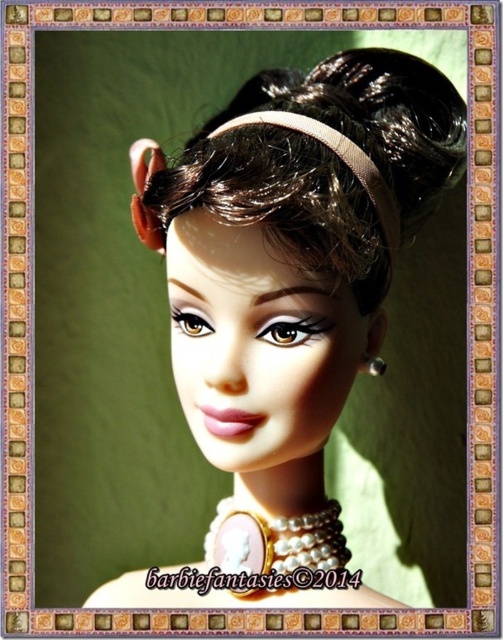
Can you confirm if brown matte headband at upper center is positioned to the left of silver metallic earring at upper center?

Correct, you'll find brown matte headband at upper center to the left of silver metallic earring at upper center.

Is brown matte headband at upper center shorter than silver metallic earring at upper center?

Incorrect, brown matte headband at upper center's height does not fall short of silver metallic earring at upper center's.

This screenshot has width=503, height=640. Describe the element at coordinates (327, 164) in the screenshot. I see `brown matte headband at upper center` at that location.

Where is `brown matte headband at upper center`? This screenshot has width=503, height=640. brown matte headband at upper center is located at coordinates (327, 164).

Who is taller, matte plastic doll at center or brown matte headband at upper center?

Standing taller between the two is matte plastic doll at center.

Who is lower down, matte plastic doll at center or brown matte headband at upper center?

matte plastic doll at center

Where is `matte plastic doll at center`? This screenshot has height=640, width=503. matte plastic doll at center is located at coordinates (291, 278).

Does matte plastic doll at center appear over silver metallic earring at upper center?

Yes, matte plastic doll at center is above silver metallic earring at upper center.

Identify the location of matte plastic doll at center. (291, 278).